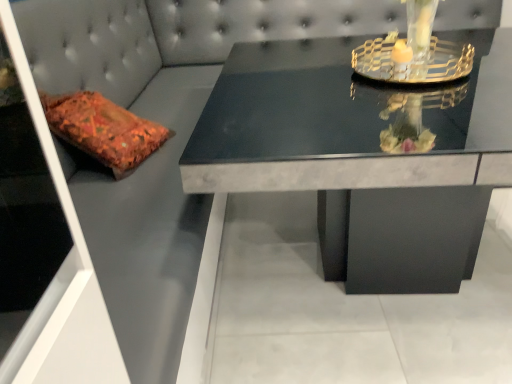
Question: Considering the relative positions of transparent glass door at left and black marble table at center in the image provided, is transparent glass door at left to the left of black marble table at center from the viewer's perspective?

Choices:
 (A) yes
 (B) no

Answer: (A)

Question: Is transparent glass door at left oriented towards black marble table at center?

Choices:
 (A) no
 (B) yes

Answer: (B)

Question: Is transparent glass door at left located outside black marble table at center?

Choices:
 (A) no
 (B) yes

Answer: (B)

Question: Is transparent glass door at left to the right of black marble table at center from the viewer's perspective?

Choices:
 (A) no
 (B) yes

Answer: (A)

Question: Considering the relative sizes of transparent glass door at left and black marble table at center in the image provided, is transparent glass door at left thinner than black marble table at center?

Choices:
 (A) yes
 (B) no

Answer: (A)

Question: Is transparent glass door at left behind black marble table at center?

Choices:
 (A) yes
 (B) no

Answer: (B)

Question: Considering the relative sizes of black marble table at center and transparent glass door at left in the image provided, is black marble table at center smaller than transparent glass door at left?

Choices:
 (A) yes
 (B) no

Answer: (B)

Question: From a real-world perspective, is black marble table at center beneath transparent glass door at left?

Choices:
 (A) no
 (B) yes

Answer: (B)

Question: From a real-world perspective, does black marble table at center stand above transparent glass door at left?

Choices:
 (A) yes
 (B) no

Answer: (B)

Question: Can you confirm if black marble table at center is positioned to the right of transparent glass door at left?

Choices:
 (A) no
 (B) yes

Answer: (B)

Question: Is black marble table at center thinner than transparent glass door at left?

Choices:
 (A) no
 (B) yes

Answer: (A)

Question: Is black marble table at center turned away from transparent glass door at left?

Choices:
 (A) yes
 (B) no

Answer: (A)

Question: Does black marble table at center have a greater height compared to clear glass candle holder at upper right?

Choices:
 (A) no
 (B) yes

Answer: (B)